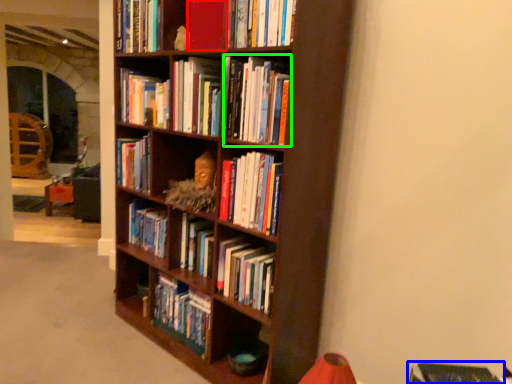
Question: Based on their relative distances, which object is farther from book (highlighted by a red box)? Choose from book (highlighted by a blue box) and book (highlighted by a green box).

Choices:
 (A) book
 (B) book

Answer: (A)